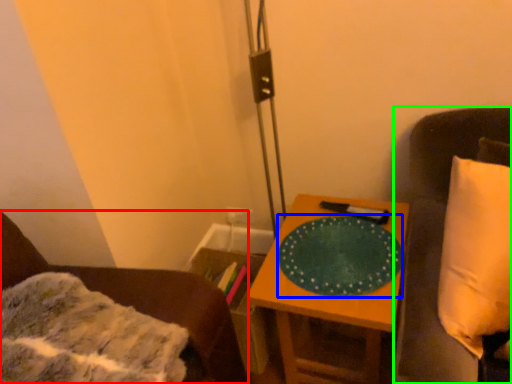
Question: Which is farther away from furniture (highlighted by a red box)? platter (highlighted by a blue box) or furniture (highlighted by a green box)?

Choices:
 (A) platter
 (B) furniture

Answer: (B)